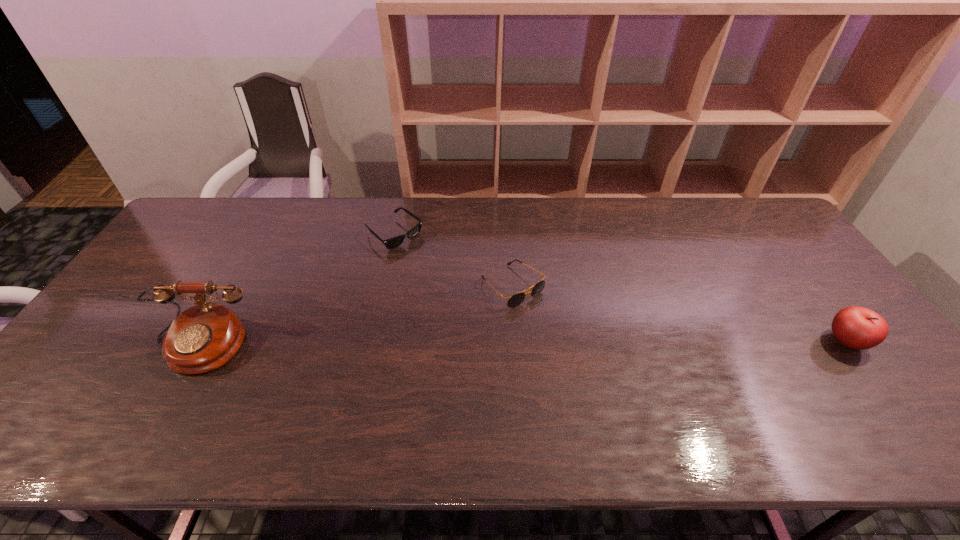
Where is `vacant space located on the front-facing side of the farthest object`? vacant space located on the front-facing side of the farthest object is located at coordinates (448, 276).

Find the location of `blank space located on the front-facing side of the farthest object`. blank space located on the front-facing side of the farthest object is located at coordinates (500, 317).

Where is `free spot located on the front-facing side of the farthest object`? free spot located on the front-facing side of the farthest object is located at coordinates (482, 303).

Identify the location of vacant area located on the lenses of the nearer sunglasses. (573, 343).

Find the location of a particular element. Image resolution: width=960 pixels, height=540 pixels. vacant area located 0.330m on the lenses of the nearer sunglasses is located at coordinates (623, 391).

Where is `free space located on the lenses of the nearer sunglasses`? free space located on the lenses of the nearer sunglasses is located at coordinates (549, 322).

You are a GUI agent. You are given a task and a screenshot of the screen. Output one action in this format:
    pyautogui.click(x=<x>, y=<y>)
    Task: Click on the object that is at the far edge
    This screenshot has height=540, width=960.
    Given the screenshot: What is the action you would take?
    pyautogui.click(x=391, y=243)

Where is `object that is at the near edge`? Image resolution: width=960 pixels, height=540 pixels. object that is at the near edge is located at coordinates (204, 337).

Where is `object located in the left edge section of the desktop`? object located in the left edge section of the desktop is located at coordinates (204, 337).

This screenshot has height=540, width=960. Find the location of `object that is at the right edge`. object that is at the right edge is located at coordinates (859, 328).